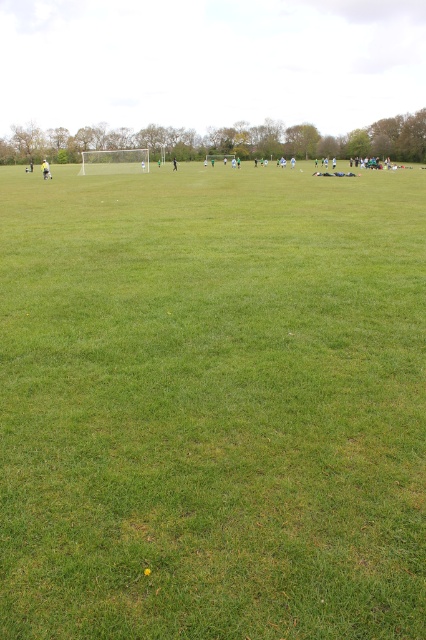
Question: In this image, where is green grass field at center located relative to black fabric person at center?

Choices:
 (A) below
 (B) above

Answer: (A)

Question: Is green grass field at center wider than black fabric person at center?

Choices:
 (A) no
 (B) yes

Answer: (B)

Question: Among these points, which one is farthest from the camera?

Choices:
 (A) (172, 160)
 (B) (51, 173)

Answer: (A)

Question: Does green grass field at center have a smaller size compared to black fabric person at center?

Choices:
 (A) no
 (B) yes

Answer: (A)

Question: Which of these objects is positioned farthest from the black fabric person at center?

Choices:
 (A) green grass field at center
 (B) light brown leather jacket at left

Answer: (A)

Question: Which object appears closest to the camera in this image?

Choices:
 (A) green grass field at center
 (B) light brown leather jacket at left
 (C) black fabric person at center

Answer: (A)